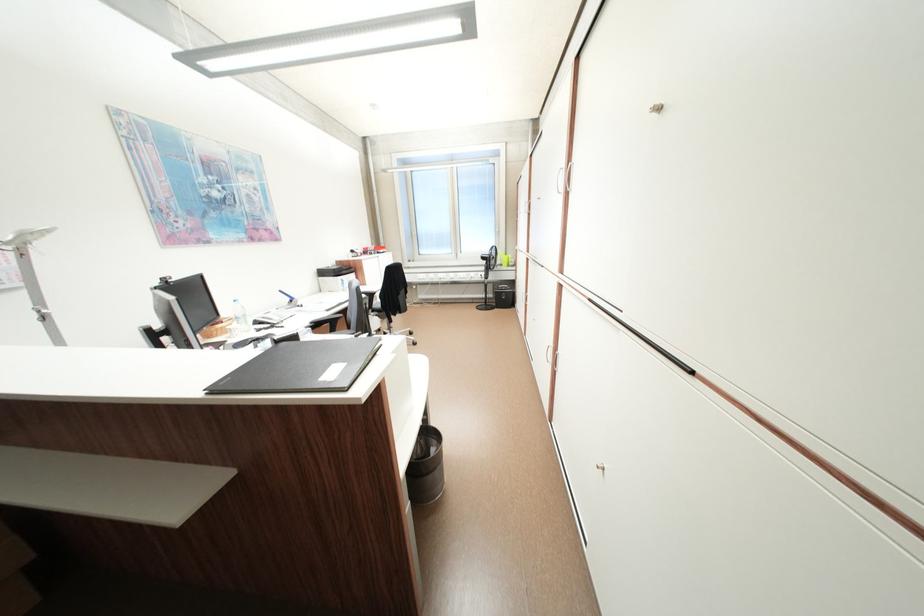
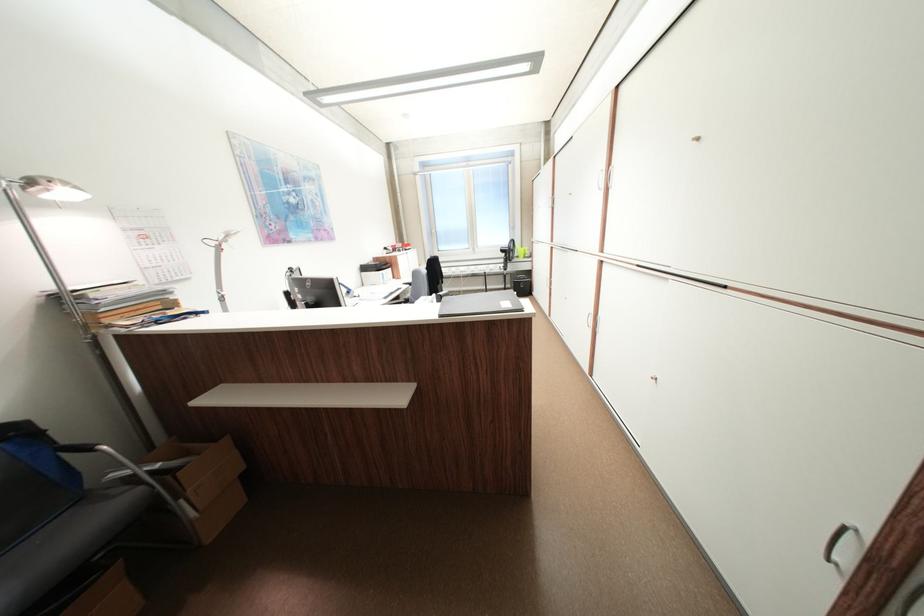
Question: The images are taken continuously from a first-person perspective. In which direction is your viewpoint rotating?

Choices:
 (A) Left
 (B) Right
 (C) Up
 (D) Down

Answer: (B)